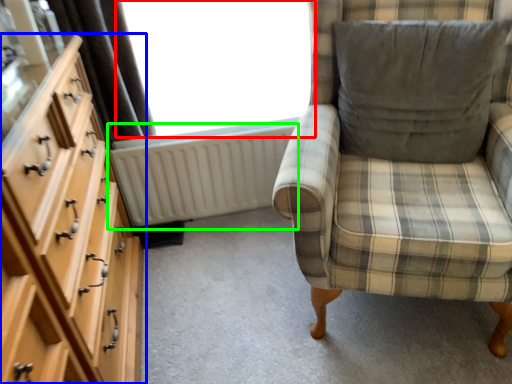
Question: Considering the real-world distances, which object is farthest from window (highlighted by a red box)? chest of drawers (highlighted by a blue box) or radiator (highlighted by a green box)?

Choices:
 (A) chest of drawers
 (B) radiator

Answer: (A)